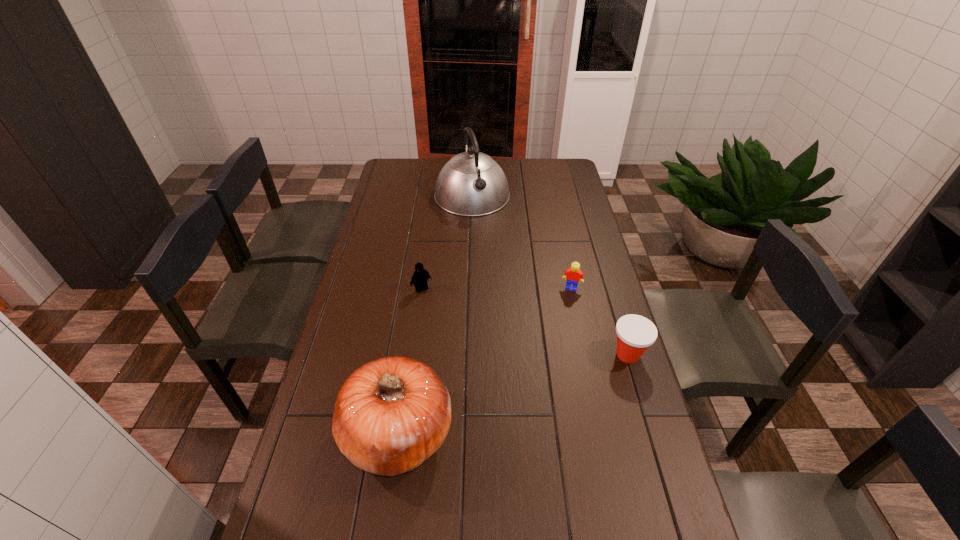
Find the location of a particular element. The height and width of the screenshot is (540, 960). the second tallest object is located at coordinates (391, 414).

This screenshot has height=540, width=960. I want to click on pumpkin, so click(x=391, y=414).

I want to click on the fourth farthest object, so click(x=635, y=333).

Locate an element on the screen. Image resolution: width=960 pixels, height=540 pixels. the rightmost object is located at coordinates (635, 333).

Identify the location of the left Lego. (420, 276).

At what (x,y) coordinates should I click in order to perform the action: click on the right Lego. Please return your answer as a coordinate pair (x, y). Looking at the image, I should click on (573, 274).

Where is `kettle`? This screenshot has width=960, height=540. kettle is located at coordinates (470, 184).

You are a GUI agent. You are given a task and a screenshot of the screen. Output one action in this format:
    pyautogui.click(x=<x>, y=<y>)
    Task: Click on the farthest object
    
    Given the screenshot: What is the action you would take?
    pyautogui.click(x=470, y=184)

Identify the location of free point located on the right of the fourth shortest object. 584,432.

Where is `free space located 0.230m on the left of the rightmost object`? The image size is (960, 540). free space located 0.230m on the left of the rightmost object is located at coordinates (536, 354).